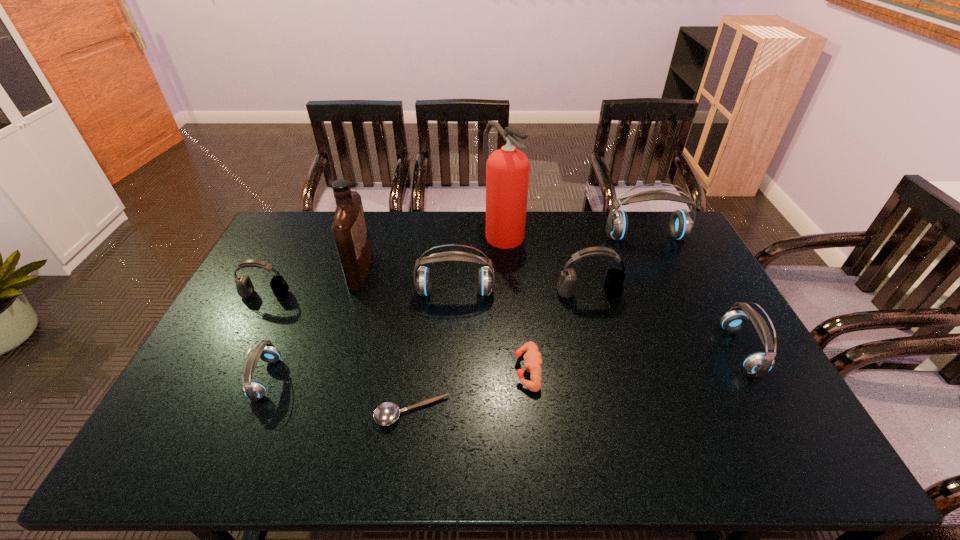
This screenshot has height=540, width=960. Find the location of `the third biggest blue headset`. the third biggest blue headset is located at coordinates 759,363.

This screenshot has width=960, height=540. I want to click on the left black headset, so click(245, 288).

Where is `the leftmost object`? The width and height of the screenshot is (960, 540). the leftmost object is located at coordinates (245, 288).

You are a GUI agent. You are given a task and a screenshot of the screen. Output one action in this format:
    pyautogui.click(x=<x>, y=<y>)
    Task: Click on the fifth headset from right to left
    
    Given the screenshot: What is the action you would take?
    pyautogui.click(x=266, y=351)

Where is `the eighth tallest object`? This screenshot has width=960, height=540. the eighth tallest object is located at coordinates (266, 351).

Locate an element on the screen. Image resolution: width=960 pixels, height=540 pixels. red puncher is located at coordinates (533, 360).

Where is `the ninth tallest object`? The height and width of the screenshot is (540, 960). the ninth tallest object is located at coordinates (533, 360).

At what (x,y) coordinates should I click in order to perform the action: click on the shortest object. Please return your answer as a coordinate pair (x, y). Looking at the image, I should click on (387, 413).

Locate an element on the screen. The height and width of the screenshot is (540, 960). gray ladle is located at coordinates (387, 413).

Identify the location of vacant space positioned 0.190m on the handle side of the red fire extinguisher. Image resolution: width=960 pixels, height=540 pixels. (507, 289).